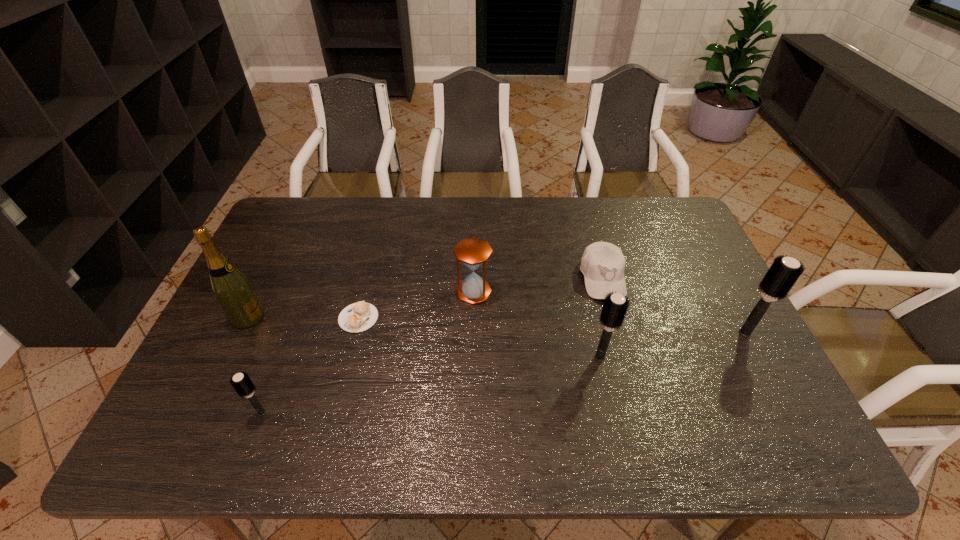
This screenshot has width=960, height=540. In order to click on location for an additional hairbrush to make spacing equal in this screenshot , I will do `click(439, 383)`.